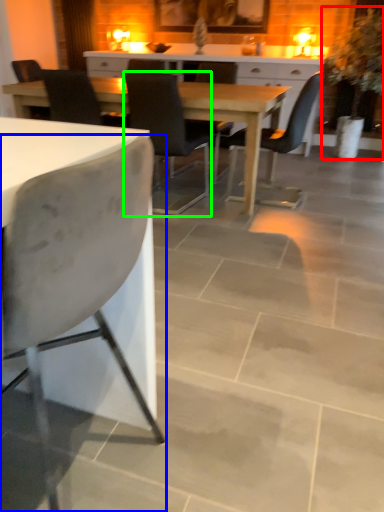
Question: Which object is the farthest from houseplant (highlighted by a red box)? Choose among these: chair (highlighted by a blue box) or chair (highlighted by a green box).

Choices:
 (A) chair
 (B) chair

Answer: (A)